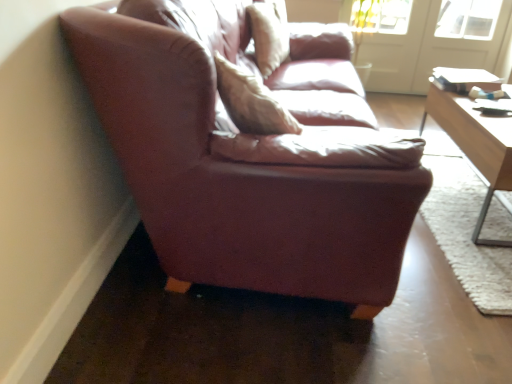
Question: From a real-world perspective, is leather couch at left on light brown wooden table at right?

Choices:
 (A) yes
 (B) no

Answer: (B)

Question: Is leather couch at left behind light brown wooden table at right?

Choices:
 (A) yes
 (B) no

Answer: (B)

Question: From the image's perspective, is leather couch at left located above light brown wooden table at right?

Choices:
 (A) yes
 (B) no

Answer: (B)

Question: Is leather couch at left outside of light brown wooden table at right?

Choices:
 (A) yes
 (B) no

Answer: (A)

Question: Would you say leather couch at left is a long distance from light brown wooden table at right?

Choices:
 (A) yes
 (B) no

Answer: (A)

Question: Considering the positions of leather couch at left and white glossy door at upper right, the first screen door positioned from the right, in the image, is leather couch at left wider or thinner than white glossy door at upper right, the first screen door positioned from the right,?

Choices:
 (A) thin
 (B) wide

Answer: (B)

Question: From the image's perspective, is leather couch at left positioned above or below white glossy door at upper right, the second screen door when ordered from left to right?

Choices:
 (A) below
 (B) above

Answer: (A)

Question: In terms of height, does leather couch at left look taller or shorter compared to white glossy door at upper right, the first screen door positioned from the right?

Choices:
 (A) short
 (B) tall

Answer: (A)

Question: Do you think leather couch at left is within white glossy door at upper right, the first screen door positioned from the right, or outside of it?

Choices:
 (A) outside
 (B) inside

Answer: (A)

Question: Considering the positions of leather pillow at center and white glass screen door at upper right, arranged as the first screen door when viewed from the left, in the image, is leather pillow at center wider or thinner than white glass screen door at upper right, arranged as the first screen door when viewed from the left,?

Choices:
 (A) thin
 (B) wide

Answer: (B)

Question: From a real-world perspective, is leather pillow at center positioned above or below white glass screen door at upper right, arranged as the first screen door when viewed from the left?

Choices:
 (A) below
 (B) above

Answer: (B)

Question: Visually, is leather pillow at center positioned to the left or to the right of white glass screen door at upper right, which is counted as the second screen door, starting from the right?

Choices:
 (A) right
 (B) left

Answer: (B)

Question: In the image, is leather pillow at center positioned in front of or behind white glass screen door at upper right, arranged as the first screen door when viewed from the left?

Choices:
 (A) behind
 (B) front

Answer: (B)

Question: Based on their positions, is white glass screen door at upper right, which is counted as the second screen door, starting from the right, located to the left or right of light brown wooden table at right?

Choices:
 (A) left
 (B) right

Answer: (A)

Question: Based on their sizes in the image, would you say white glass screen door at upper right, which is counted as the second screen door, starting from the right, is bigger or smaller than light brown wooden table at right?

Choices:
 (A) small
 (B) big

Answer: (A)